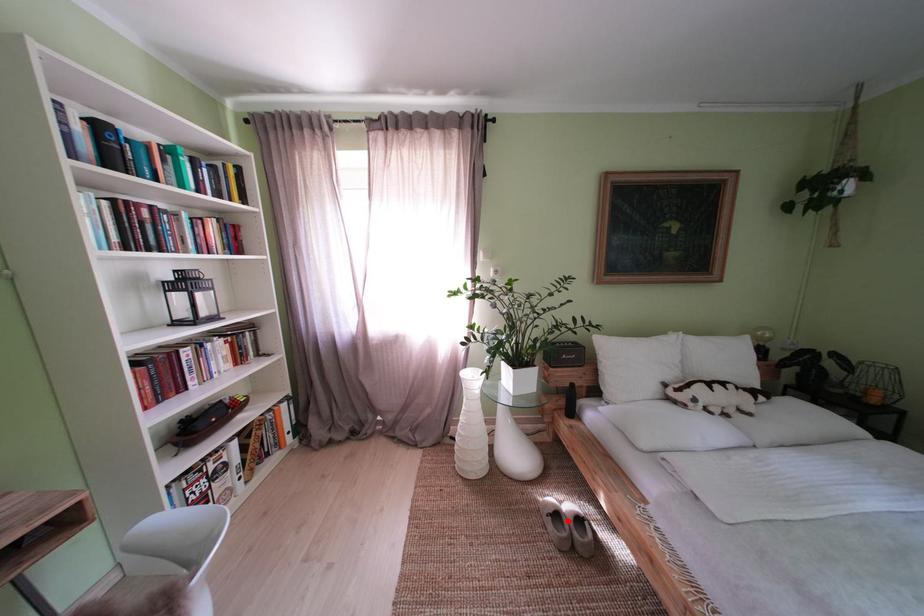
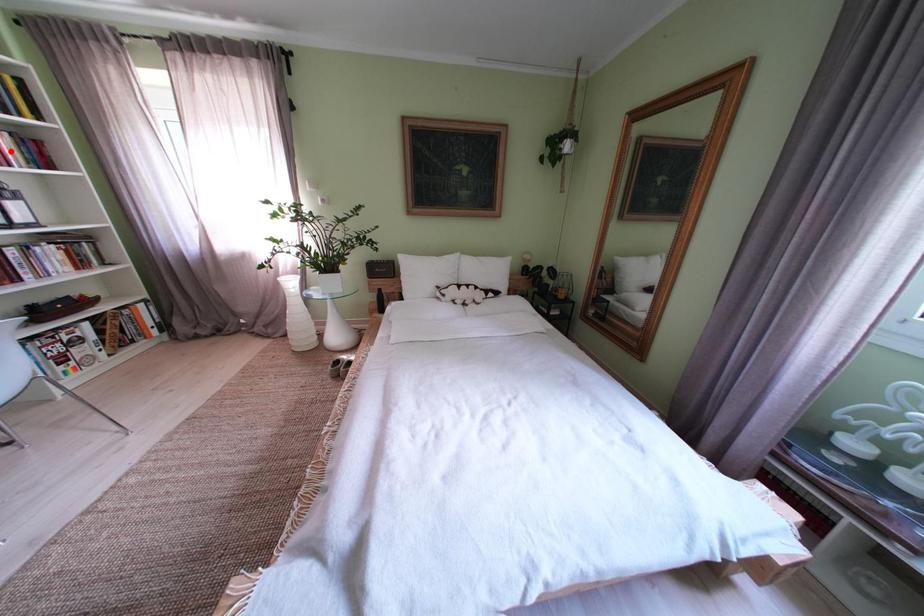
I am providing you with two images of the same scene from different viewpoints. A red point is marked on the first image and another point is marked on the second image. Do the highlighted points in image1 and image2 indicate the same real-world spot?

No